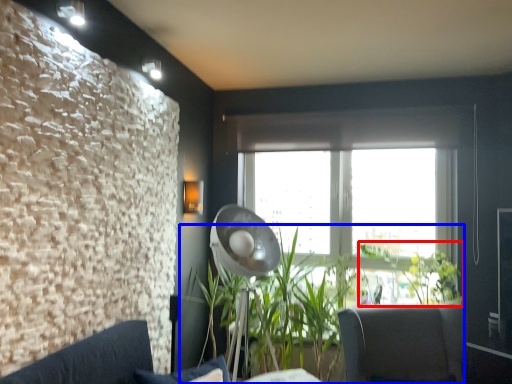
Question: Among these objects, which one is farthest to the camera, plant (highlighted by a red box) or houseplant (highlighted by a blue box)?

Choices:
 (A) plant
 (B) houseplant

Answer: (A)